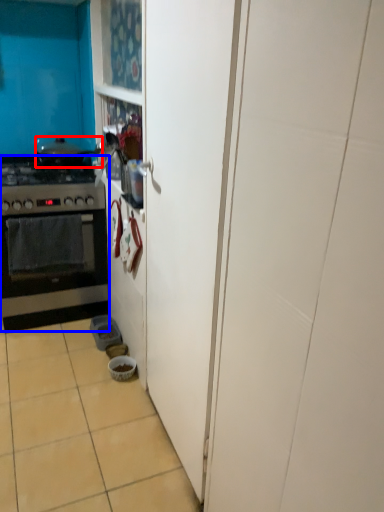
Question: Which object is further to the camera taking this photo, pot/pan (highlighted by a red box) or kitchen appliance (highlighted by a blue box)?

Choices:
 (A) pot/pan
 (B) kitchen appliance

Answer: (A)